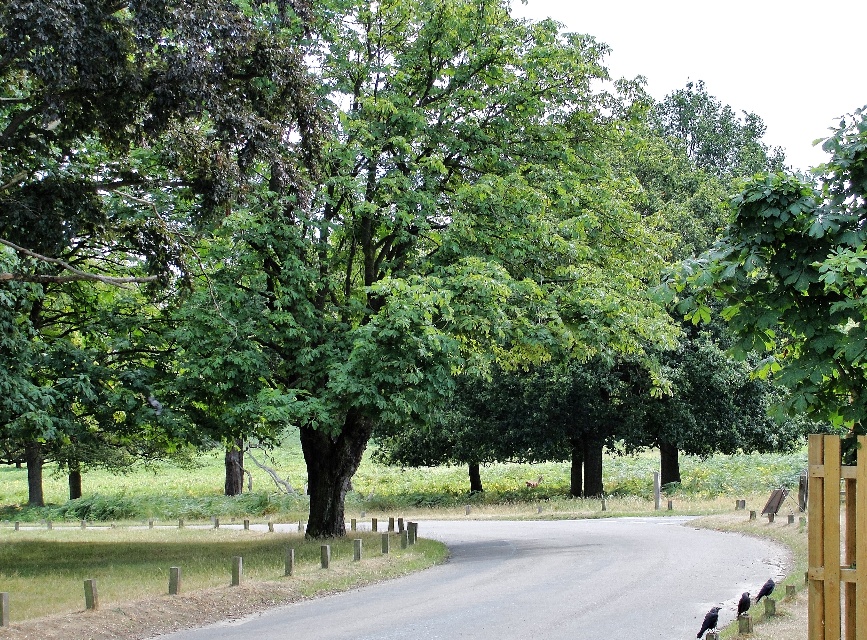
You are standing at the point with coordinates (180, 576) in the park. What object is located at that exact point?

The wooden post at lower center is located at point (180, 576).